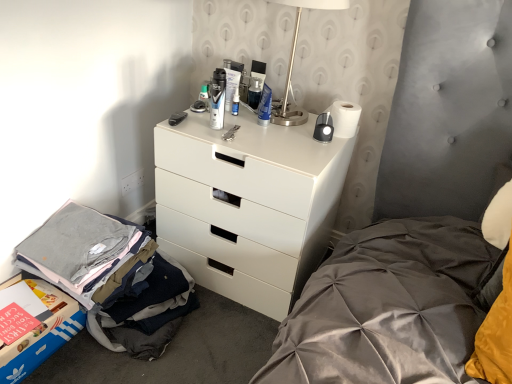
The width and height of the screenshot is (512, 384). Identify the location of vacant space in between blue plastic tube at center, positioned as the 5th toiletry in left-to-right order, and matte black shaving cream can at center, acting as the 4th toiletry starting from the right. (236, 125).